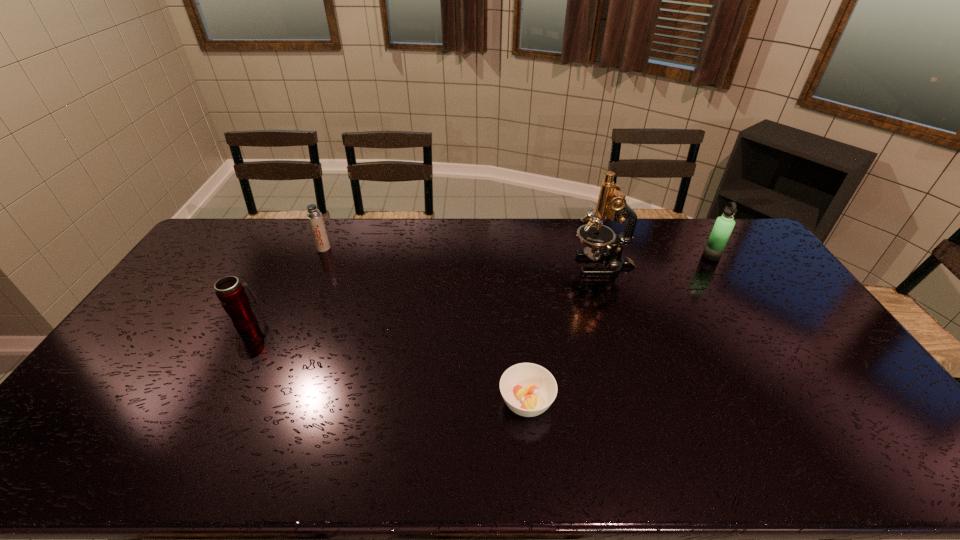
Where is `blank space located 0.130m at the eyepiece of the tallest object`? The height and width of the screenshot is (540, 960). blank space located 0.130m at the eyepiece of the tallest object is located at coordinates (535, 265).

Image resolution: width=960 pixels, height=540 pixels. Find the location of `vacant space situated 0.180m at the eyepiece of the tallest object`. vacant space situated 0.180m at the eyepiece of the tallest object is located at coordinates (520, 265).

Image resolution: width=960 pixels, height=540 pixels. Find the location of `vacant space located on the front of the rightmost object`. vacant space located on the front of the rightmost object is located at coordinates (738, 298).

Identify the location of vacant space located on the front of the second thermos bottle from right to left. (300, 300).

I want to click on vacant space located 0.110m on the side with the handle of the leftmost object, so click(266, 290).

At what (x,y) coordinates should I click in order to perform the action: click on vacant space positioned on the side with the handle of the leftmost object. Please return your answer as a coordinate pair (x, y). The width and height of the screenshot is (960, 540). Looking at the image, I should click on (282, 260).

Find the location of a particular element. free location located 0.240m on the side with the handle of the leftmost object is located at coordinates (279, 265).

The image size is (960, 540). In order to click on vacant point located on the left of the third object from left to right in this screenshot , I will do `click(460, 402)`.

Where is `microscope that is at the far edge`? The height and width of the screenshot is (540, 960). microscope that is at the far edge is located at coordinates (611, 204).

This screenshot has width=960, height=540. I want to click on object that is at the right edge, so click(x=722, y=229).